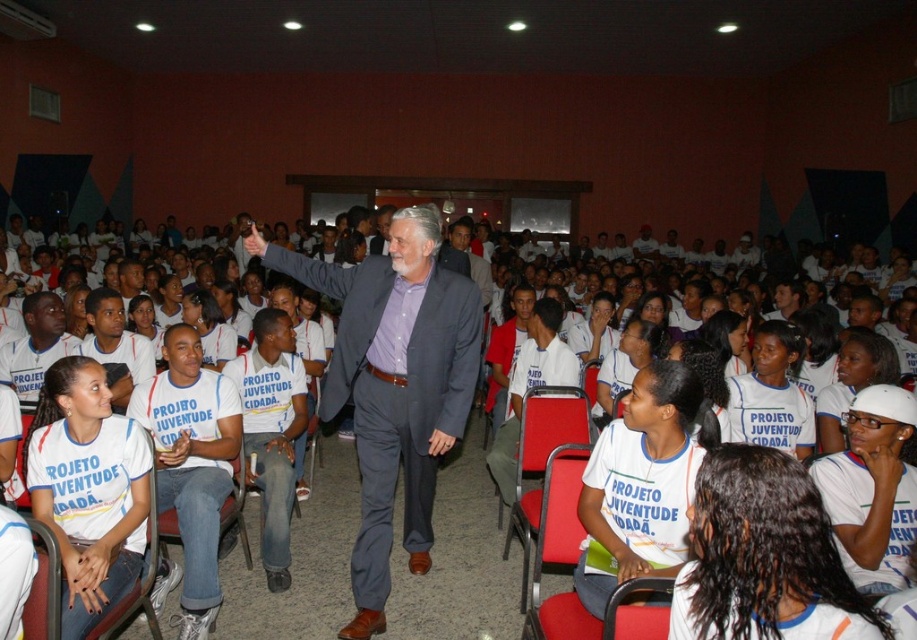
You are sitting in the audience and want to look at two specific points in the room. The first point is at coordinates point (768, 513) and the second is at point (538, 448). Which point will appear larger to your eyes?

Point (768, 513) is closer to the viewer than point (538, 448), so it will appear larger.